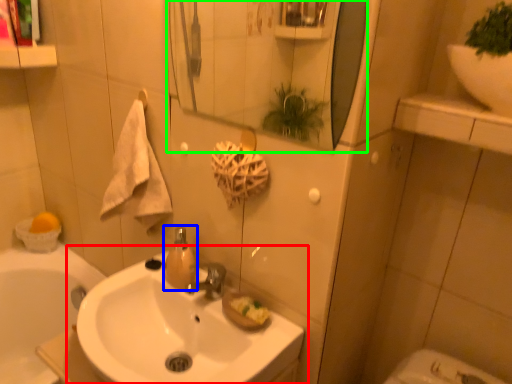
Question: Which object is the farthest from sink (highlighted by a red box)? Choose among these: soap dispenser (highlighted by a blue box) or mirror (highlighted by a green box).

Choices:
 (A) soap dispenser
 (B) mirror

Answer: (B)